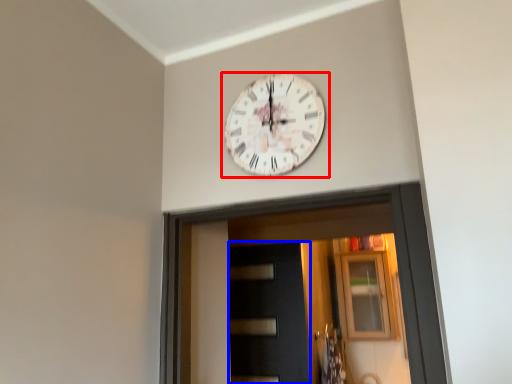
Question: Which object is closer to the camera taking this photo, wall clock (highlighted by a red box) or door (highlighted by a blue box)?

Choices:
 (A) wall clock
 (B) door

Answer: (A)